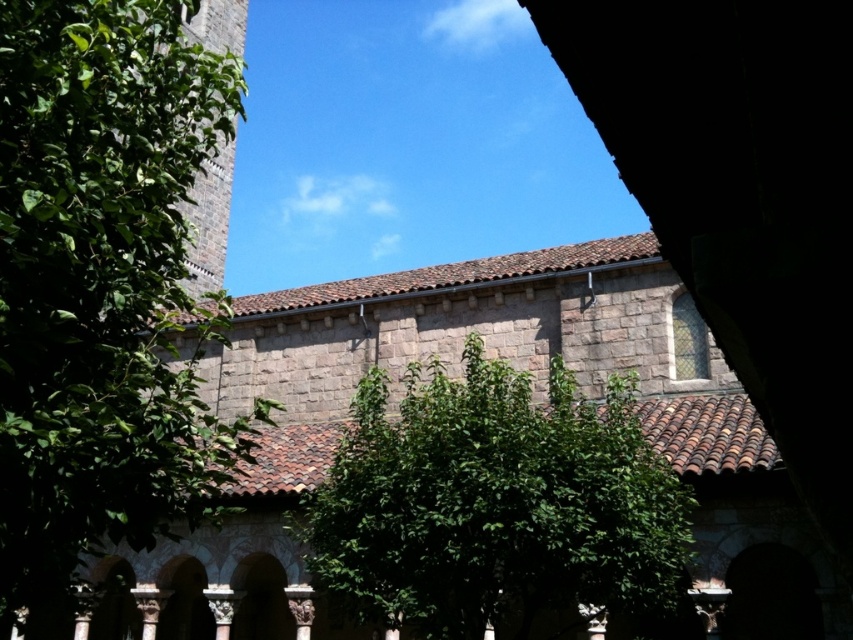
You are standing in a shaded area of the historic stone building and see the green leafy tree at upper left and the green leafy tree at center. Which tree is nearer to you?

The green leafy tree at upper left is closer to the viewer than the green leafy tree at center.

You are standing in a shaded area and want to walk towards the green leafy tree at center. Which direction should you move relative to the green leafy tree at upper left?

The green leafy tree at upper left is to the left of the green leafy tree at center. To reach the green leafy tree at center, you should move to the right relative to the green leafy tree at upper left.

You are standing in a shaded area of the historic stone building and notice two green leafy trees. Which tree, the green leafy tree at upper left or the green leafy tree at center, is positioned higher in the image?

The green leafy tree at upper left is located above the green leafy tree at center, so it is positioned higher in the image.